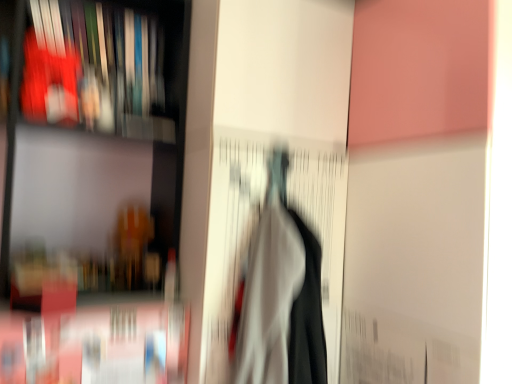
Measure the distance between matte plastic book at upper left and camera.

They are 4.23 feet apart.

Image resolution: width=512 pixels, height=384 pixels. Describe the element at coordinates (93, 68) in the screenshot. I see `matte plastic book at upper left` at that location.

Where is `matte plastic book at upper left`? The height and width of the screenshot is (384, 512). matte plastic book at upper left is located at coordinates (93, 68).

Is white fabric at center far from matte plastic book at upper left?

No.

Considering the sizes of white fabric at center and matte plastic book at upper left in the image, is white fabric at center bigger or smaller than matte plastic book at upper left?

Clearly, white fabric at center is larger in size than matte plastic book at upper left.

Is white fabric at center aimed at matte plastic book at upper left?

No, white fabric at center is not oriented towards matte plastic book at upper left.

Between white fabric at center and matte plastic book at upper left, which one has more height?

white fabric at center is taller.

Is matte plastic book at upper left thinner than white fabric at center?

Indeed, matte plastic book at upper left has a lesser width compared to white fabric at center.

Which is more to the right, matte plastic book at upper left or white fabric at center?

From the viewer's perspective, white fabric at center appears more on the right side.

Does point (61, 69) come farther from viewer compared to point (237, 321)?

Yes, it is.

Can white fabric at center be found inside matte plastic book at upper left?

No, matte plastic book at upper left does not contain white fabric at center.

From a real-world perspective, which is physically below, matte black bookshelf at left or matte plastic book at upper left?

From a 3D spatial view, matte black bookshelf at left is below.

Which object is further away from the camera, matte black bookshelf at left or matte plastic book at upper left?

matte plastic book at upper left is more distant.

Can you confirm if matte black bookshelf at left is taller than matte plastic book at upper left?

Indeed, matte black bookshelf at left has a greater height compared to matte plastic book at upper left.

In terms of height, does white fabric at center look taller or shorter compared to matte black bookshelf at left?

Clearly, white fabric at center is shorter compared to matte black bookshelf at left.

At what (x,y) coordinates should I click in order to perform the action: click on shelf located behind the white fabric at center. Please return your answer as a coordinate pair (x, y). Image resolution: width=512 pixels, height=384 pixels. Looking at the image, I should click on (96, 185).

Is white fabric at center next to matte black bookshelf at left and touching it?

No, white fabric at center is not in contact with matte black bookshelf at left.

Is matte plastic book at upper left turned away from matte black bookshelf at left?

Absolutely, matte plastic book at upper left is directed away from matte black bookshelf at left.

The height and width of the screenshot is (384, 512). Identify the location of shelf below the matte plastic book at upper left (from the image's perspective). (96, 185).

From the image's perspective, is matte plastic book at upper left on top of matte black bookshelf at left?

Indeed, from the image's perspective, matte plastic book at upper left is shown above matte black bookshelf at left.

Between matte plastic book at upper left and matte black bookshelf at left, which one is positioned in front?

matte black bookshelf at left is more forward.

Is matte black bookshelf at left positioned before white fabric at center?

No, matte black bookshelf at left is behind white fabric at center.

Which is correct: matte black bookshelf at left is inside white fabric at center, or outside of it?

matte black bookshelf at left is spatially situated outside white fabric at center.

How different are the orientations of matte black bookshelf at left and white fabric at center in degrees?

0.338 degrees separate the facing orientations of matte black bookshelf at left and white fabric at center.

Find the location of a particular element. The height and width of the screenshot is (384, 512). woman in front of the matte plastic book at upper left is located at coordinates (279, 295).

This screenshot has width=512, height=384. I want to click on book behind the white fabric at center, so click(93, 68).

Considering their positions, is matte black bookshelf at left positioned closer to white fabric at center than matte plastic book at upper left?

matte black bookshelf at left lies closer to white fabric at center than the other object.

Considering their positions, is white fabric at center positioned further to matte plastic book at upper left than matte black bookshelf at left?

white fabric at center.

Looking at the image, which one is located closer to matte plastic book at upper left, matte black bookshelf at left or white fabric at center?

matte black bookshelf at left.

Considering their positions, is white fabric at center positioned closer to matte black bookshelf at left than matte plastic book at upper left?

Based on the image, matte plastic book at upper left appears to be nearer to matte black bookshelf at left.

From the image, which object appears to be farther from matte black bookshelf at left, matte plastic book at upper left or white fabric at center?

white fabric at center is further to matte black bookshelf at left.

Based on their spatial positions, is matte plastic book at upper left or matte black bookshelf at left further from white fabric at center?

matte plastic book at upper left lies further to white fabric at center than the other object.

Locate an element on the screen. book situated between matte black bookshelf at left and white fabric at center from left to right is located at coordinates (93, 68).